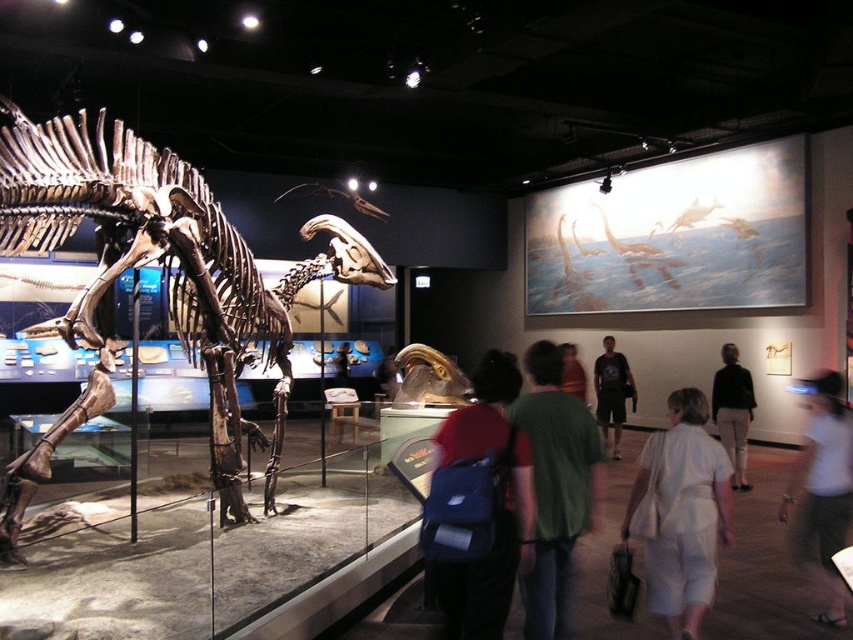
Question: Is green fabric shirt at center positioned behind white cotton shirt at lower right?

Choices:
 (A) no
 (B) yes

Answer: (A)

Question: Among these points, which one is farthest from the camera?

Choices:
 (A) (635, 518)
 (B) (572, 392)
 (C) (817, 620)
 (D) (491, 372)

Answer: (B)

Question: Estimate the real-world distances between objects in this image. Which object is farther from the light beige pants at center?

Choices:
 (A) green fabric shirt at center
 (B) white cotton shirt at center
 (C) blue fabric backpack at center

Answer: (C)

Question: Which point is farther from the camera taking this photo?

Choices:
 (A) (503, 419)
 (B) (730, 470)

Answer: (B)

Question: Is brown metallic dinosaur skeleton at center further to the viewer compared to white cotton shirt at lower right?

Choices:
 (A) yes
 (B) no

Answer: (B)

Question: Does blue fabric backpack at center appear on the right side of light brown leather jacket at center?

Choices:
 (A) yes
 (B) no

Answer: (B)